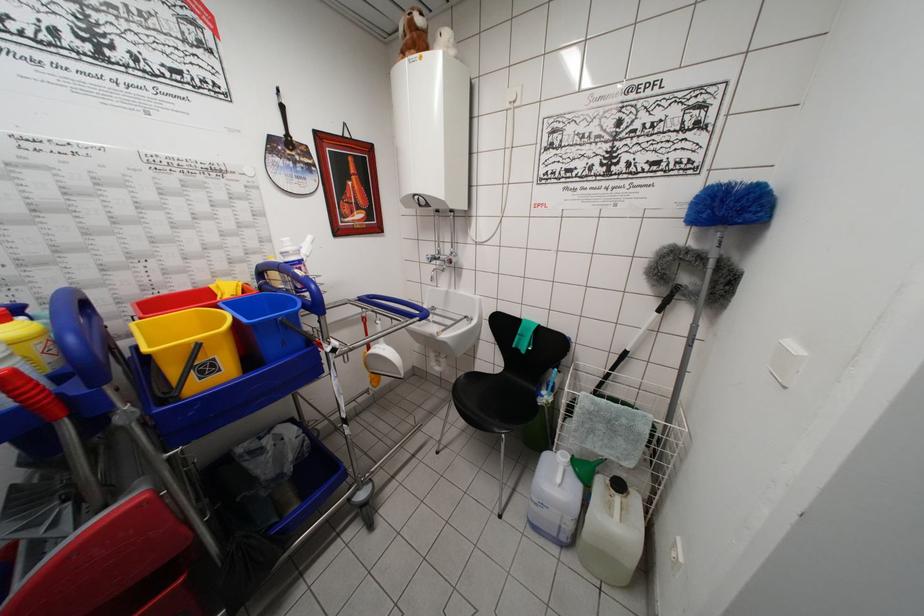
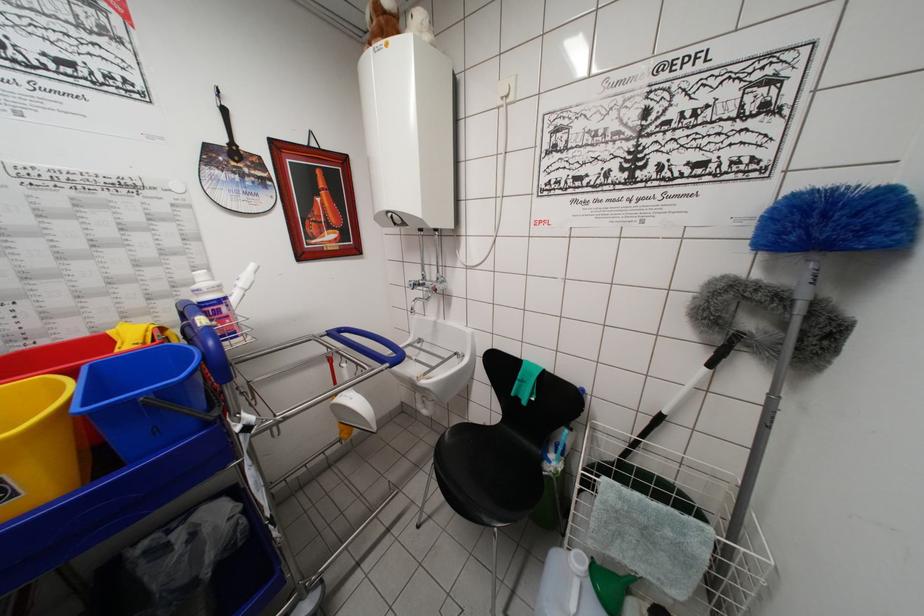
Where in the second image is the point corresponding to (x=304, y=280) from the first image?

(202, 330)